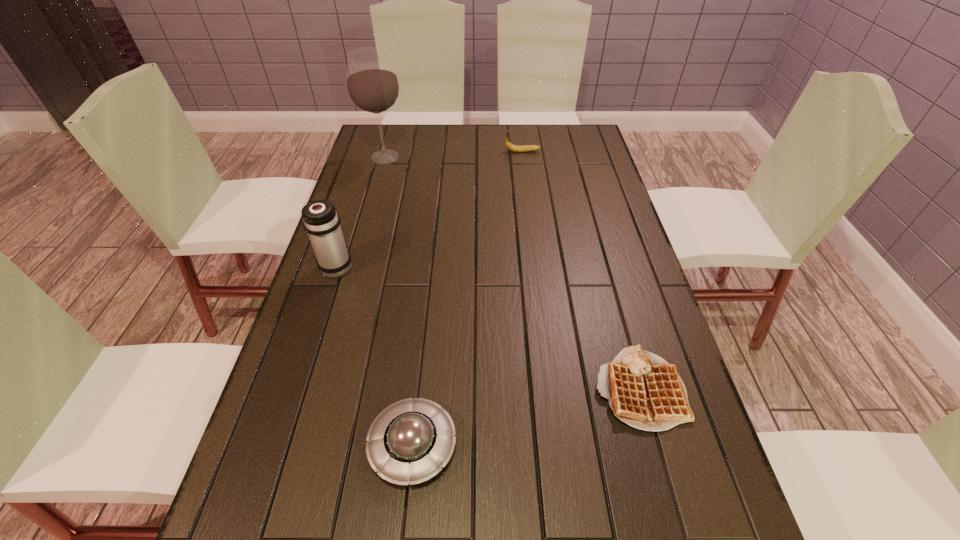
Locate an element on the screen. The image size is (960, 540). empty space that is in between the tallest object and the third object from right to left is located at coordinates (399, 301).

Find the location of a particular element. empty space that is in between the fourth shortest object and the alcohol is located at coordinates (361, 212).

Identify the location of free area in between the fourth object from left to right and the tallest object. (454, 154).

Locate an element on the screen. Image resolution: width=960 pixels, height=540 pixels. unoccupied position between the tallest object and the waffle is located at coordinates (513, 273).

Locate an element on the screen. free point between the rightmost object and the second object from right to left is located at coordinates (581, 270).

Find the location of `free spot between the saucer and the second tallest object`. free spot between the saucer and the second tallest object is located at coordinates (375, 355).

Identify which object is the third nearest to the waffle. Please provide its 2D coordinates. Your answer should be formatted as a tuple, i.e. [(x, y)], where the tuple contains the x and y coordinates of a point satisfying the conditions above.

[(509, 146)]

Image resolution: width=960 pixels, height=540 pixels. Find the location of `object that is the closest one to the thermos bottle`. object that is the closest one to the thermos bottle is located at coordinates (410, 441).

The width and height of the screenshot is (960, 540). I want to click on vacant space that satisfies the following two spatial constraints: 1. on the back side of the shortest object; 2. at the stem of the fourth object from left to right, so click(573, 151).

Where is `free space that satisfies the following two spatial constraints: 1. on the side with the handle of the alcohol; 2. on the right side of the third nearest object`? This screenshot has width=960, height=540. free space that satisfies the following two spatial constraints: 1. on the side with the handle of the alcohol; 2. on the right side of the third nearest object is located at coordinates (372, 157).